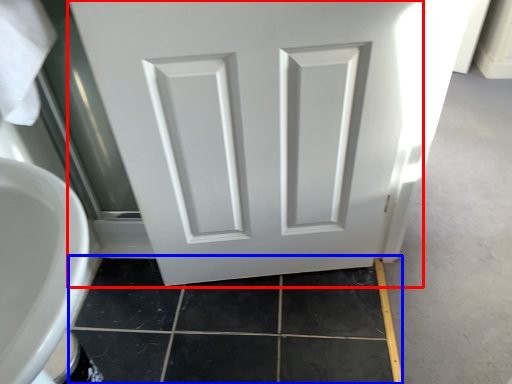
Question: Which point is further to the camera, door (highlighted by a red box) or tile (highlighted by a blue box)?

Choices:
 (A) door
 (B) tile

Answer: (B)